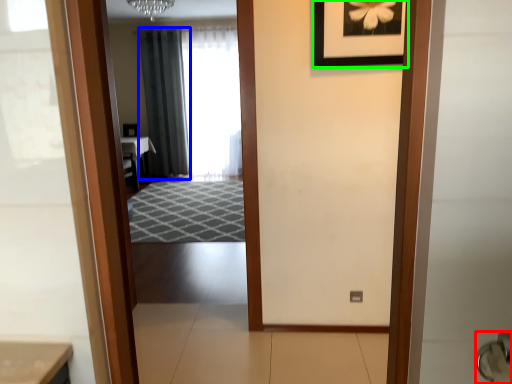
Question: Which object is the closest to the door handle (highlighted by a red box)? Choose among these: curtain (highlighted by a blue box) or picture frame (highlighted by a green box).

Choices:
 (A) curtain
 (B) picture frame

Answer: (B)